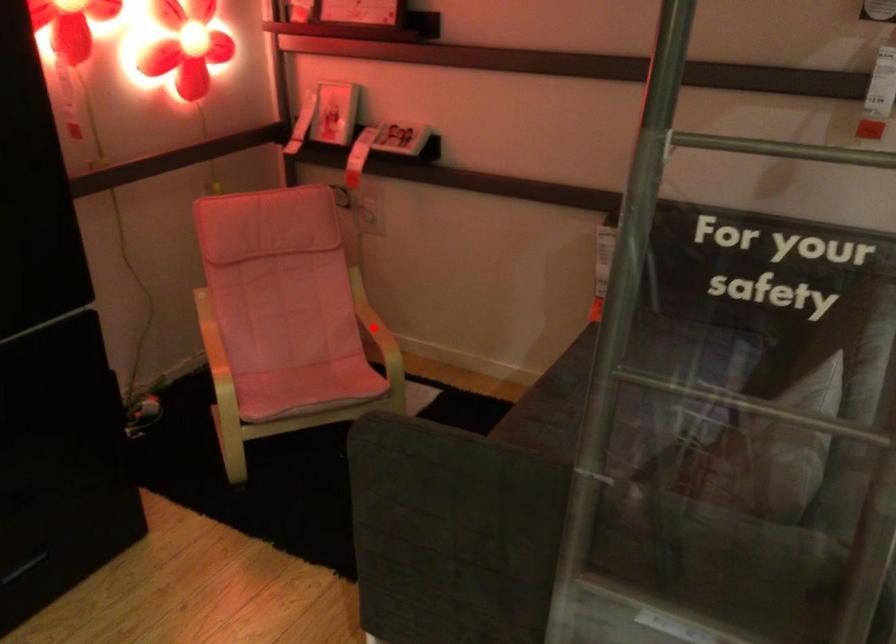
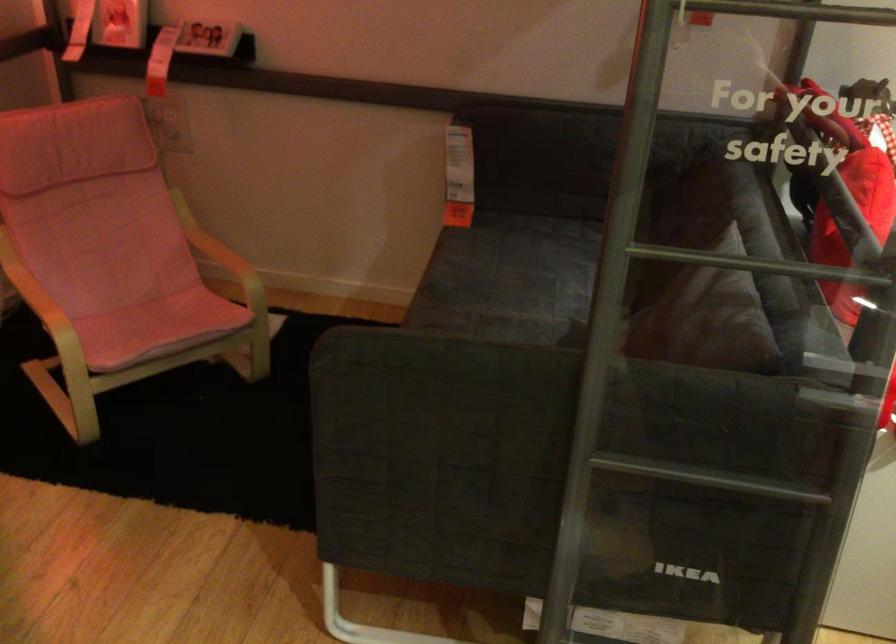
Locate, in the second image, the point that corresponds to the highlighted location in the first image.

(220, 252)